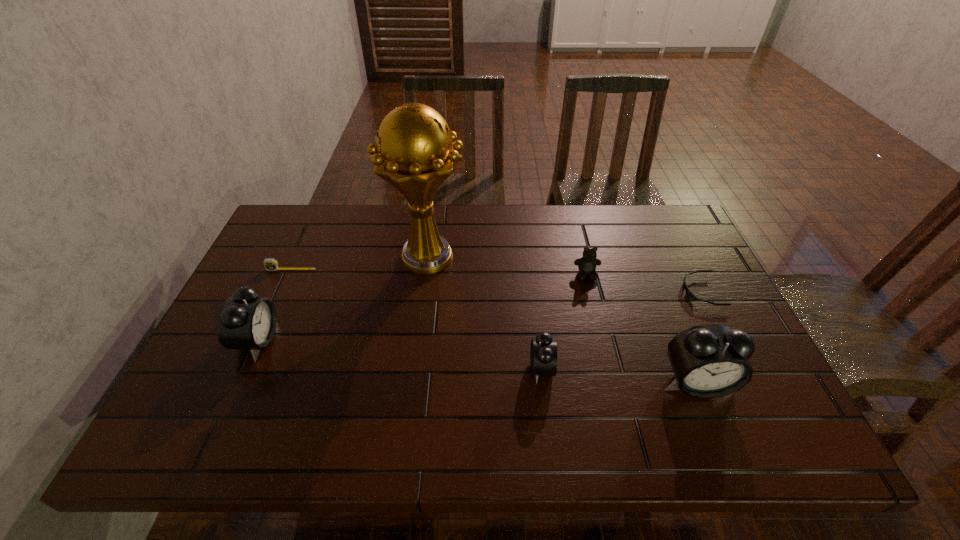
At what (x,y) coordinates should I click in order to perform the action: click on vacant region located on the front side of the second shortest alarm clock. Please return your answer as a coordinate pair (x, y). The image size is (960, 540). Looking at the image, I should click on (302, 341).

Where is `vacant space located on the front side of the fourth object from right to left`? This screenshot has height=540, width=960. vacant space located on the front side of the fourth object from right to left is located at coordinates (444, 368).

Find the location of a particular element. This screenshot has height=540, width=960. vacant space located 0.330m on the front side of the fourth object from right to left is located at coordinates (389, 368).

Find the location of a particular element. vacant space located 0.320m on the front side of the fourth object from right to left is located at coordinates (394, 368).

You are a GUI agent. You are given a task and a screenshot of the screen. Output one action in this format:
    pyautogui.click(x=<x>, y=<y>)
    Task: Click on the vacant point located on the face of the fifth object from left to right
    This screenshot has width=960, height=540.
    Given the screenshot: What is the action you would take?
    pyautogui.click(x=594, y=306)

Identify the location of free location located 0.160m at the front of the third object from left to right where the globe is prominent. (418, 331).

Find the location of `free space located 0.340m at the front of the tape measure with the tape extended`. free space located 0.340m at the front of the tape measure with the tape extended is located at coordinates (246, 370).

Find the location of a particular element. The image size is (960, 540). vacant area situated on the front-facing side of the sunglasses is located at coordinates (x=575, y=292).

Identify the location of vacant space located 0.200m on the front-facing side of the sunglasses. (612, 292).

What are the coordinates of `free space located on the front-facing side of the sunglasses` in the screenshot? It's located at (644, 292).